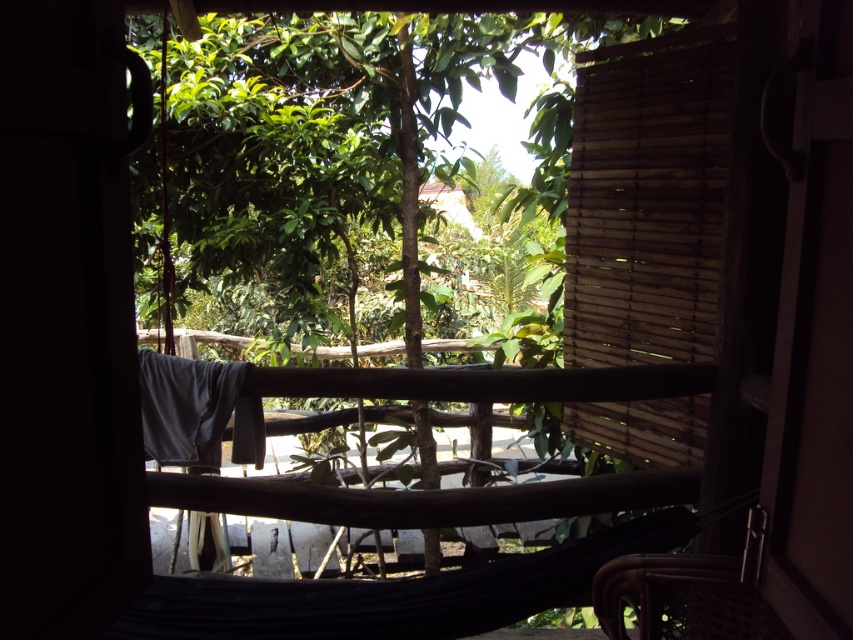
Who is more distant from viewer, (228, 138) or (718, 92)?

The point (228, 138) is behind.

Image resolution: width=853 pixels, height=640 pixels. In order to click on green leafy tree at center in this screenshot , I will do click(322, 144).

Between point (553, 406) and point (577, 115), which one is positioned behind?

The point (553, 406) is more distant.

This screenshot has width=853, height=640. I want to click on green leafy tree at center, so click(322, 144).

Can you confirm if wooden blinds at right is wider than brown woven chair at lower right?

Indeed, wooden blinds at right has a greater width compared to brown woven chair at lower right.

Who is more forward, (x=601, y=58) or (x=631, y=592)?

Point (x=631, y=592) is in front.

Locate an element on the screen. The width and height of the screenshot is (853, 640). wooden blinds at right is located at coordinates (647, 198).

Find the location of a particular element. green leafy tree at center is located at coordinates (322, 144).